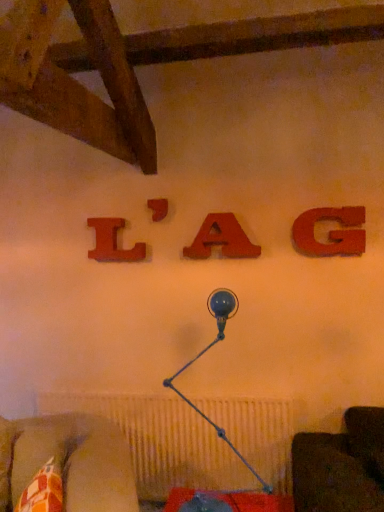
What is the approximate width of matte wood letter at center, which is the 3th alphabet in right-to-left order?

matte wood letter at center, which is the 3th alphabet in right-to-left order, is 2.48 inches wide.

Describe the element at coordinates (69, 461) in the screenshot. Image resolution: width=384 pixels, height=512 pixels. I see `patterned fabric cushion at lower left` at that location.

What is the approximate width of patterned fabric cushion at lower left?

patterned fabric cushion at lower left is 12.35 inches in width.

The height and width of the screenshot is (512, 384). What do you see at coordinates (206, 351) in the screenshot? I see `blue glass table lamp at center` at bounding box center [206, 351].

Where is `matte wood g at upper right, positioned as the fourth alphabet in left-to-right order`? The height and width of the screenshot is (512, 384). matte wood g at upper right, positioned as the fourth alphabet in left-to-right order is located at coordinates (330, 232).

What do you see at coordinates (221, 239) in the screenshot?
I see `matte wood letter a at center, placed as the second alphabet when sorted from right to left` at bounding box center [221, 239].

Describe the element at coordinates (112, 242) in the screenshot. I see `wooden letter l at upper center, the 1th alphabet viewed from the left` at that location.

Locate an element on the screen. The image size is (384, 512). wooden letter l at upper center, which appears as the fourth alphabet when viewed from the right is located at coordinates (112, 242).

The width and height of the screenshot is (384, 512). In order to click on matte wood letter at center, which ranks as the 2th alphabet in left-to-right order in this screenshot , I will do `click(158, 208)`.

Is matte wood g at upper right, positioned as the fourth alphabet in left-to-right order, touching wooden letter l at upper center, which appears as the fourth alphabet when viewed from the right?

They are not placed beside each other.

Considering the positions of objects matte wood g at upper right, positioned as the fourth alphabet in left-to-right order, and wooden letter l at upper center, the 1th alphabet viewed from the left, in the image provided, who is behind, matte wood g at upper right, positioned as the fourth alphabet in left-to-right order, or wooden letter l at upper center, the 1th alphabet viewed from the left,?

wooden letter l at upper center, the 1th alphabet viewed from the left, is more distant.

Who is shorter, matte wood g at upper right, positioned as the fourth alphabet in left-to-right order, or wooden letter l at upper center, which appears as the fourth alphabet when viewed from the right?

matte wood g at upper right, positioned as the fourth alphabet in left-to-right order.

Which of these two, blue glass table lamp at center or wooden letter l at upper center, which appears as the fourth alphabet when viewed from the right, stands taller?

Standing taller between the two is blue glass table lamp at center.

From a real-world perspective, which object rests below the other?

blue glass table lamp at center, from a real-world perspective.

Between blue glass table lamp at center and wooden letter l at upper center, the 1th alphabet viewed from the left, which one has larger size?

Bigger between the two is blue glass table lamp at center.

Between point (160, 209) and point (208, 249), which one is positioned behind?

The point (160, 209) is more distant.

Is matte wood letter a at center, placed as the second alphabet when sorted from right to left, at the back of matte wood letter at center, which ranks as the 2th alphabet in left-to-right order?

No, matte wood letter at center, which ranks as the 2th alphabet in left-to-right order, is not facing away from matte wood letter a at center, placed as the second alphabet when sorted from right to left.

From the image's perspective, which one is positioned higher, matte wood letter at center, which ranks as the 2th alphabet in left-to-right order, or matte wood letter a at center, positioned as the 3th alphabet in left-to-right order?

matte wood letter at center, which ranks as the 2th alphabet in left-to-right order, from the image's perspective.

Which of these two, matte wood letter at center, which is the 3th alphabet in right-to-left order, or matte wood letter a at center, placed as the second alphabet when sorted from right to left, stands taller?

matte wood letter a at center, placed as the second alphabet when sorted from right to left, is taller.

Considering the sizes of objects blue glass table lamp at center and matte wood letter at center, which is the 3th alphabet in right-to-left order, in the image provided, who is taller, blue glass table lamp at center or matte wood letter at center, which is the 3th alphabet in right-to-left order,?

blue glass table lamp at center.

From a real-world perspective, is blue glass table lamp at center above or below matte wood letter at center, which is the 3th alphabet in right-to-left order?

blue glass table lamp at center is situated lower than matte wood letter at center, which is the 3th alphabet in right-to-left order, in the real world.

In the scene shown: Is blue glass table lamp at center with matte wood letter at center, which ranks as the 2th alphabet in left-to-right order?

There is a gap between blue glass table lamp at center and matte wood letter at center, which ranks as the 2th alphabet in left-to-right order.

Is blue glass table lamp at center positioned with its back to matte wood letter at center, which ranks as the 2th alphabet in left-to-right order?

No, blue glass table lamp at center is not facing away from matte wood letter at center, which ranks as the 2th alphabet in left-to-right order.

Is wooden letter l at upper center, which appears as the fourth alphabet when viewed from the right, oriented towards patterned fabric cushion at lower left?

No.

Does point (122, 249) lie behind point (7, 426)?

Yes.

Looking at this image, considering the relative sizes of wooden letter l at upper center, which appears as the fourth alphabet when viewed from the right, and patterned fabric cushion at lower left in the image provided, is wooden letter l at upper center, which appears as the fourth alphabet when viewed from the right, thinner than patterned fabric cushion at lower left?

Yes, wooden letter l at upper center, which appears as the fourth alphabet when viewed from the right, is thinner than patterned fabric cushion at lower left.

Is patterned fabric cushion at lower left not close to matte wood g at upper right, positioned as the fourth alphabet in left-to-right order?

Yes, patterned fabric cushion at lower left and matte wood g at upper right, positioned as the fourth alphabet in left-to-right order, are located far from each other.

From the image's perspective, is patterned fabric cushion at lower left below matte wood g at upper right, marked as the first alphabet in a right-to-left arrangement?

Yes.

Is patterned fabric cushion at lower left wider than matte wood g at upper right, marked as the first alphabet in a right-to-left arrangement?

Yes, patterned fabric cushion at lower left is wider than matte wood g at upper right, marked as the first alphabet in a right-to-left arrangement.

Does patterned fabric cushion at lower left turn towards matte wood g at upper right, marked as the first alphabet in a right-to-left arrangement?

No, patterned fabric cushion at lower left is not turned towards matte wood g at upper right, marked as the first alphabet in a right-to-left arrangement.

From a real-world perspective, count 4th alphabets upward from the patterned fabric cushion at lower left and point to it. Please provide its 2D coordinates.

[(158, 208)]

Considering the relative sizes of matte wood letter at center, which ranks as the 2th alphabet in left-to-right order, and patterned fabric cushion at lower left in the image provided, is matte wood letter at center, which ranks as the 2th alphabet in left-to-right order, thinner than patterned fabric cushion at lower left?

Yes.

Looking at the image, does matte wood letter at center, which is the 3th alphabet in right-to-left order, seem bigger or smaller compared to patterned fabric cushion at lower left?

In the image, matte wood letter at center, which is the 3th alphabet in right-to-left order, appears to be smaller than patterned fabric cushion at lower left.

Can you confirm if matte wood letter at center, which ranks as the 2th alphabet in left-to-right order, is positioned to the left of patterned fabric cushion at lower left?

No, matte wood letter at center, which ranks as the 2th alphabet in left-to-right order, is not to the left of patterned fabric cushion at lower left.

From the image's perspective, starting from the wooden letter l at upper center, the 1th alphabet viewed from the left, which alphabet is the 2nd one above? Please provide its 2D coordinates.

[(330, 232)]

The width and height of the screenshot is (384, 512). I want to click on alphabet that is the 2nd one when counting leftward from the blue glass table lamp at center, so pos(112,242).

Considering their positions, is matte wood letter a at center, positioned as the 3th alphabet in left-to-right order, positioned further to blue glass table lamp at center than matte wood letter at center, which ranks as the 2th alphabet in left-to-right order?

matte wood letter at center, which ranks as the 2th alphabet in left-to-right order.

Looking at the image, which one is located further to patterned fabric cushion at lower left, matte wood letter at center, which ranks as the 2th alphabet in left-to-right order, or wooden letter l at upper center, which appears as the fourth alphabet when viewed from the right?

Among the two, matte wood letter at center, which ranks as the 2th alphabet in left-to-right order, is located further to patterned fabric cushion at lower left.

Looking at the image, which one is located further to patterned fabric cushion at lower left, blue glass table lamp at center or matte wood letter a at center, positioned as the 3th alphabet in left-to-right order?

Based on the image, matte wood letter a at center, positioned as the 3th alphabet in left-to-right order, appears to be further to patterned fabric cushion at lower left.

Based on the photo, considering their positions, is matte wood letter at center, which is the 3th alphabet in right-to-left order, positioned closer to matte wood letter a at center, positioned as the 3th alphabet in left-to-right order, than blue glass table lamp at center?

matte wood letter at center, which is the 3th alphabet in right-to-left order, is closer to matte wood letter a at center, positioned as the 3th alphabet in left-to-right order.

Based on their spatial positions, is wooden letter l at upper center, the 1th alphabet viewed from the left, or matte wood letter a at center, placed as the second alphabet when sorted from right to left, further from patterned fabric cushion at lower left?

matte wood letter a at center, placed as the second alphabet when sorted from right to left, lies further to patterned fabric cushion at lower left than the other object.

Looking at the image, which one is located closer to matte wood letter at center, which is the 3th alphabet in right-to-left order, blue glass table lamp at center or wooden letter l at upper center, the 1th alphabet viewed from the left?

wooden letter l at upper center, the 1th alphabet viewed from the left, is closer to matte wood letter at center, which is the 3th alphabet in right-to-left order.

Looking at the image, which one is located closer to wooden letter l at upper center, which appears as the fourth alphabet when viewed from the right, matte wood g at upper right, marked as the first alphabet in a right-to-left arrangement, or matte wood letter at center, which ranks as the 2th alphabet in left-to-right order?

matte wood letter at center, which ranks as the 2th alphabet in left-to-right order, is positioned closer to the anchor wooden letter l at upper center, which appears as the fourth alphabet when viewed from the right.

Which object lies nearer to the anchor point wooden letter l at upper center, which appears as the fourth alphabet when viewed from the right, patterned fabric cushion at lower left or matte wood letter at center, which is the 3th alphabet in right-to-left order?

matte wood letter at center, which is the 3th alphabet in right-to-left order, is closer to wooden letter l at upper center, which appears as the fourth alphabet when viewed from the right.

Find the location of a particular element. table lamp between patterned fabric cushion at lower left and wooden letter l at upper center, which appears as the fourth alphabet when viewed from the right, in the front-back direction is located at coordinates (206, 351).

Identify the location of table lamp between patterned fabric cushion at lower left and matte wood g at upper right, marked as the first alphabet in a right-to-left arrangement, from left to right. The height and width of the screenshot is (512, 384). (206, 351).

Locate an element on the screen. The image size is (384, 512). alphabet between matte wood letter a at center, placed as the second alphabet when sorted from right to left, and blue glass table lamp at center vertically is located at coordinates (112, 242).

Identify the location of alphabet located between wooden letter l at upper center, the 1th alphabet viewed from the left, and matte wood letter a at center, positioned as the 3th alphabet in left-to-right order, in the left-right direction. (158, 208).